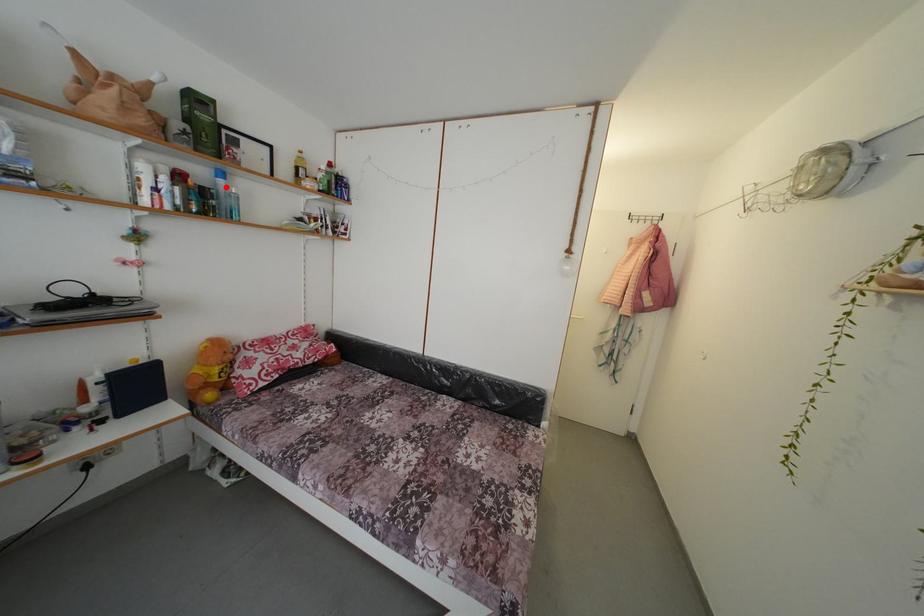
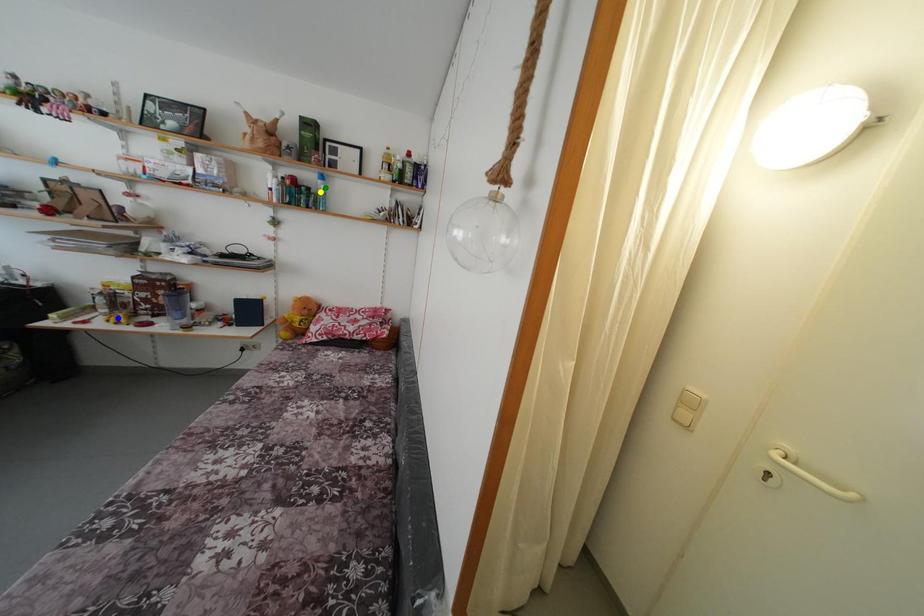
Question: I am providing you with two images of the same scene from different viewpoints. A red point is marked on the first image. You are given multiple points on the second image. In image 2, which mark is for the same physical point as the one in image 1?

Choices:
 (A) green point
 (B) yellow point
 (C) blue point

Answer: (A)